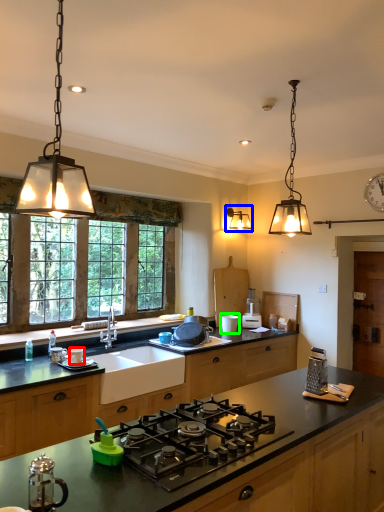
Question: Which object is the farthest from appliance (highlighted by a red box)? Choose among these: light fixture (highlighted by a blue box) or appliance (highlighted by a green box).

Choices:
 (A) light fixture
 (B) appliance

Answer: (A)